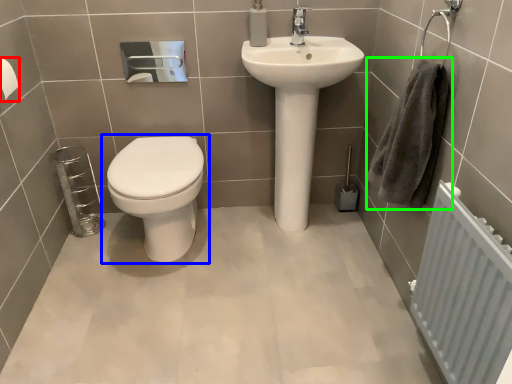
Question: Considering the real-world distances, which object is farthest from toilet paper (highlighted by a red box)? toilet (highlighted by a blue box) or hand towel (highlighted by a green box)?

Choices:
 (A) toilet
 (B) hand towel

Answer: (B)